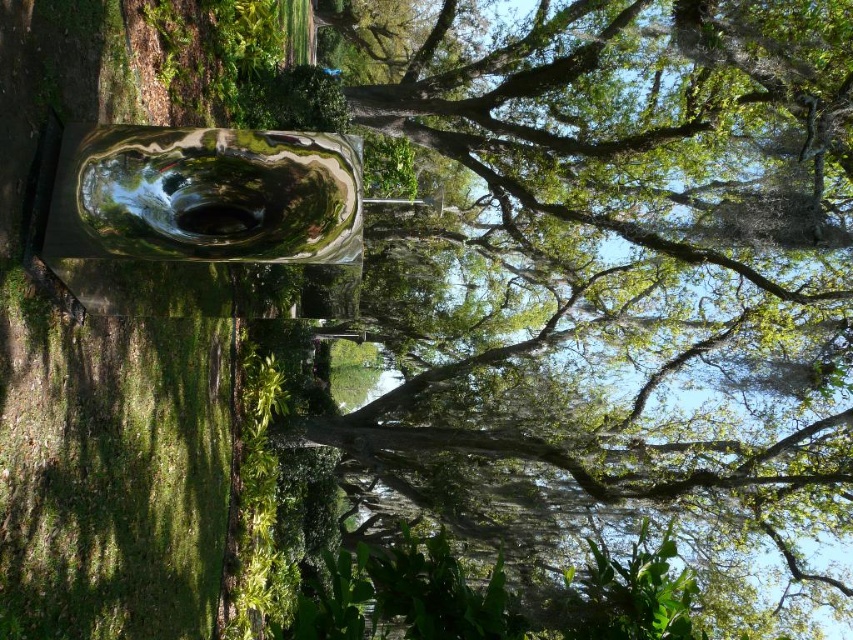
Question: Is glossy metallic sculpture at center in front of metallic reflective pool at center?

Choices:
 (A) yes
 (B) no

Answer: (B)

Question: Which point is farther to the camera?

Choices:
 (A) (473, 476)
 (B) (122, 202)

Answer: (A)

Question: Which point is closer to the camera?

Choices:
 (A) glossy metallic sculpture at center
 (B) metallic reflective pool at center

Answer: (B)

Question: Is glossy metallic sculpture at center thinner than metallic reflective pool at center?

Choices:
 (A) no
 (B) yes

Answer: (A)

Question: Is glossy metallic sculpture at center bigger than metallic reflective pool at center?

Choices:
 (A) no
 (B) yes

Answer: (B)